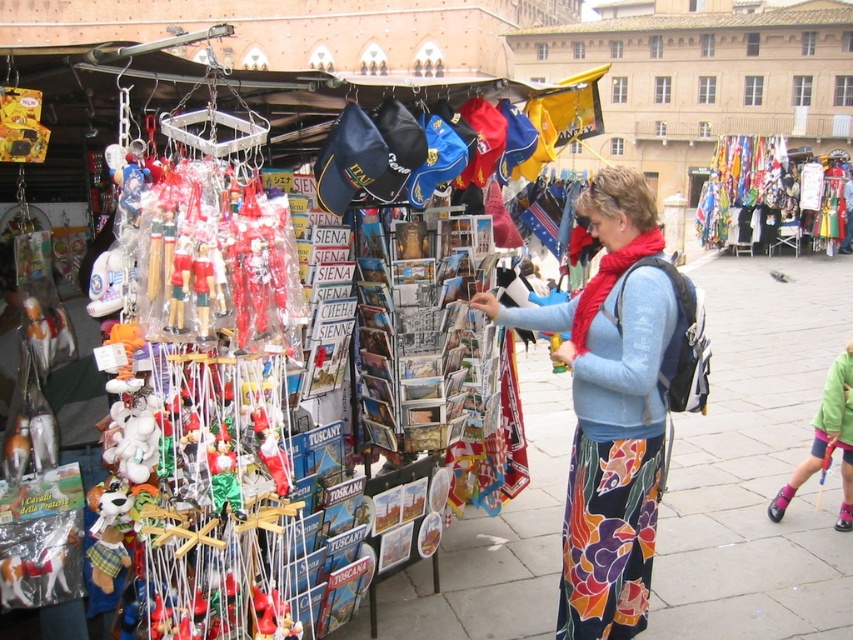
Which is above, floral cotton skirt at center or plastic pink toy at lower right?

floral cotton skirt at center is above.

Does point (573, 586) come closer to viewer compared to point (840, 420)?

Yes, it is in front of point (840, 420).

Identify the location of floral cotton skirt at center. This screenshot has width=853, height=640. (611, 410).